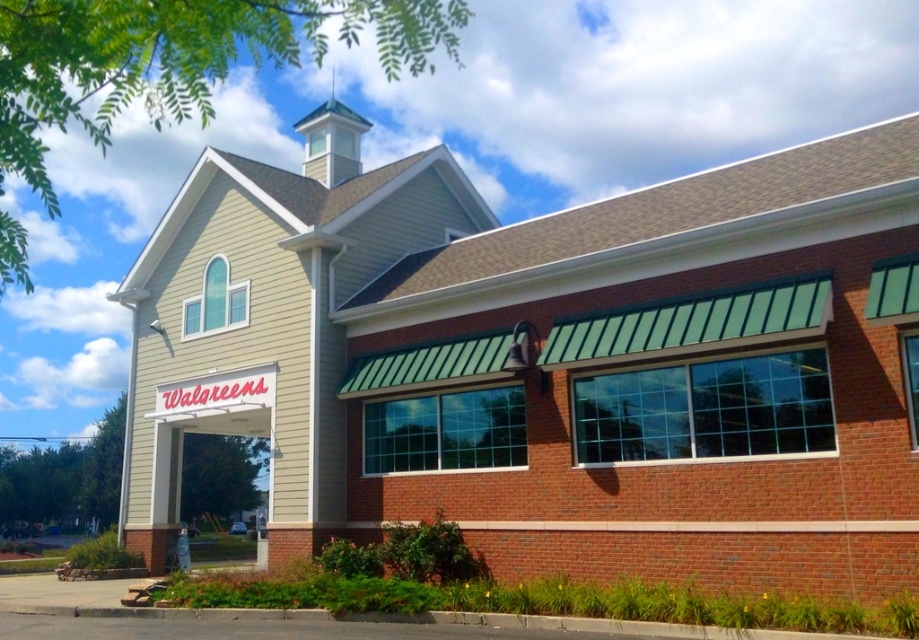
Question: Is white matte walgreens sign at center positioned behind green glass spire at upper center?

Choices:
 (A) no
 (B) yes

Answer: (A)

Question: Can you confirm if white matte walgreens sign at center is bigger than green glass spire at upper center?

Choices:
 (A) no
 (B) yes

Answer: (A)

Question: Among these objects, which one is nearest to the camera?

Choices:
 (A) white matte walgreens sign at center
 (B) green glass spire at upper center

Answer: (A)

Question: Which of the following is the farthest from the observer?

Choices:
 (A) white matte walgreens sign at center
 (B) green glass spire at upper center

Answer: (B)

Question: Is white matte walgreens sign at center bigger than green glass spire at upper center?

Choices:
 (A) no
 (B) yes

Answer: (A)